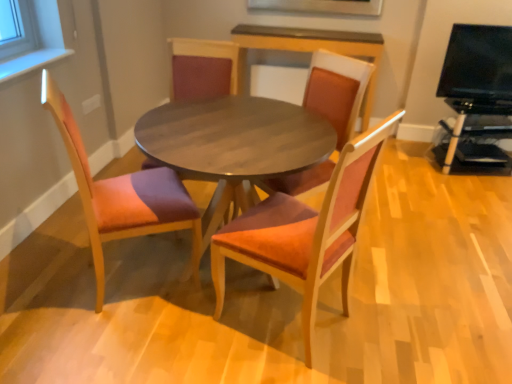
Identify the location of free spot to the right of matte wood chair at center, which appears as the 3th chair when viewed from the left. (387, 318).